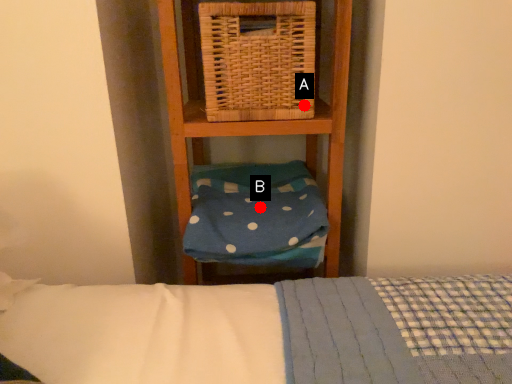
Question: Two points are circled on the image, labeled by A and B beside each circle. Which point is closer to the camera?

Choices:
 (A) A is closer
 (B) B is closer

Answer: (A)